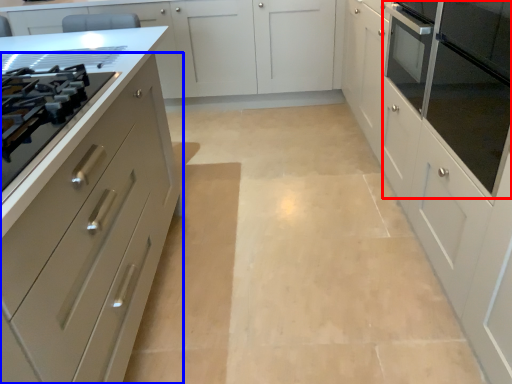
Question: Among these objects, which one is nearest to the camera, home appliance (highlighted by a red box) or cabinetry (highlighted by a blue box)?

Choices:
 (A) home appliance
 (B) cabinetry

Answer: (B)